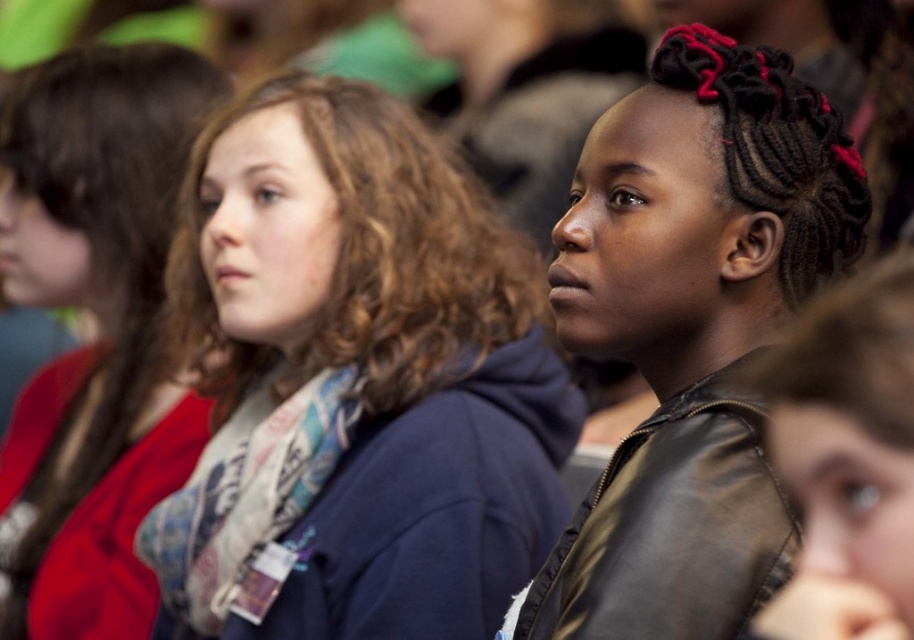
Question: Can you confirm if matte blue hoodie at center is positioned above black leather jacket at center?

Choices:
 (A) no
 (B) yes

Answer: (A)

Question: Which of these objects is positioned farthest from the leather jacket at center?

Choices:
 (A) red scarf at left
 (B) matte blue hoodie at center

Answer: (A)

Question: Which object is closer to the camera taking this photo?

Choices:
 (A) black leather jacket at center
 (B) red scarf at left

Answer: (A)

Question: Is red scarf at left to the right of leather jacket at center from the viewer's perspective?

Choices:
 (A) no
 (B) yes

Answer: (A)

Question: Considering the real-world distances, which object is farthest from the red scarf at left?

Choices:
 (A) leather jacket at center
 (B) matte blue hoodie at center
 (C) black leather jacket at center

Answer: (A)

Question: Does red scarf at left appear over leather jacket at center?

Choices:
 (A) no
 (B) yes

Answer: (B)